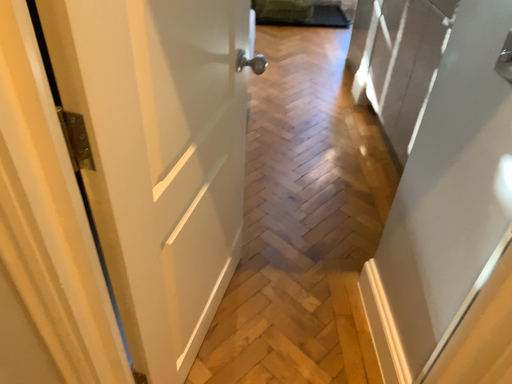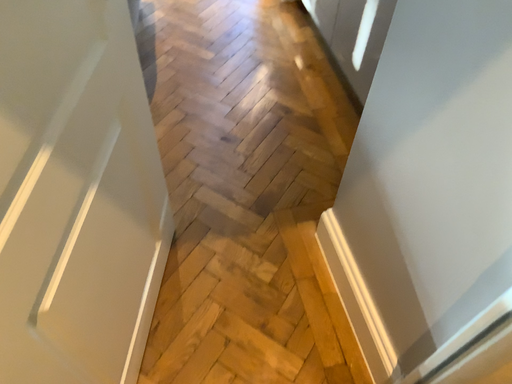
Question: How did the camera likely rotate when shooting the video?

Choices:
 (A) rotated left
 (B) rotated right

Answer: (B)